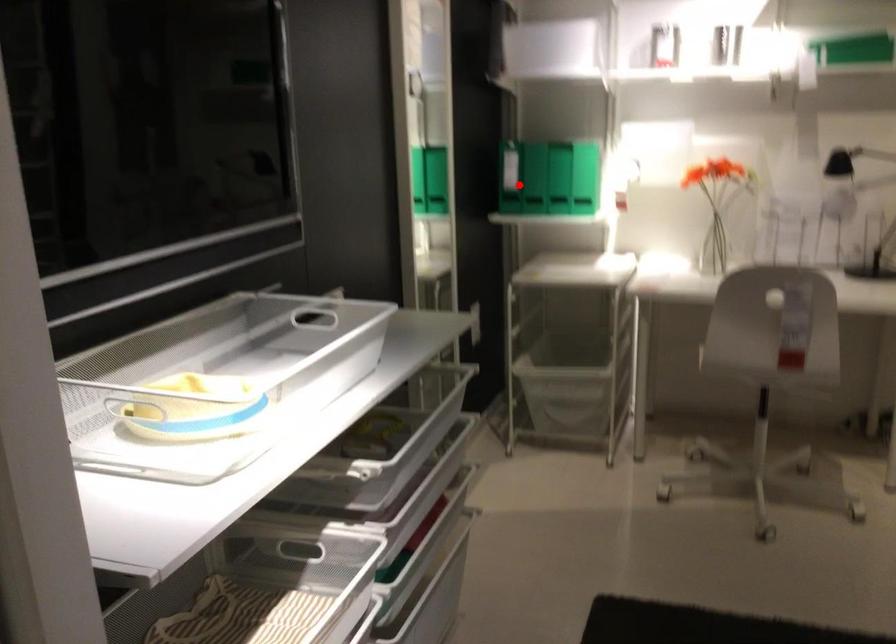
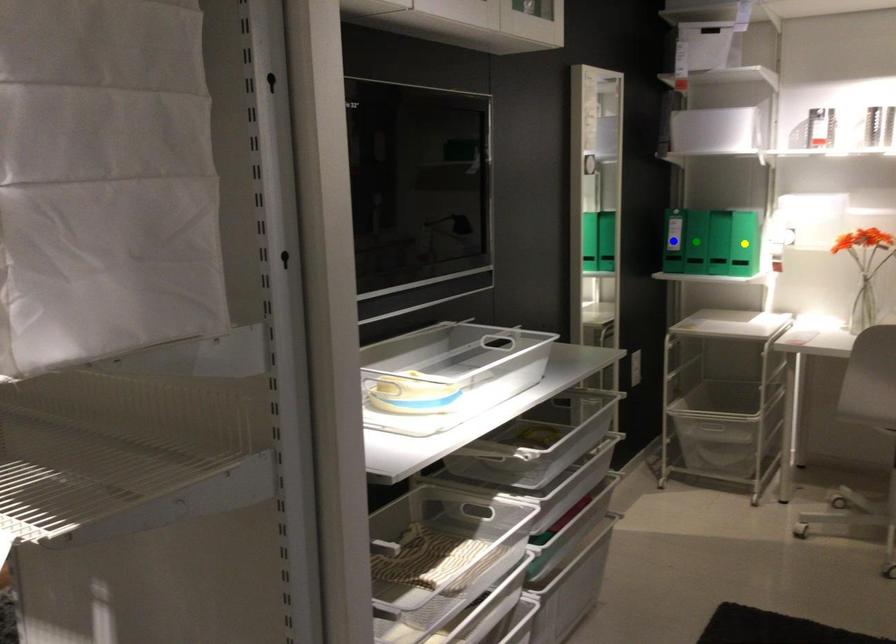
Question: I am providing you with two images of the same scene from different viewpoints. A red point is marked on the first image. You are given multiple points on the second image. Can you choose the point in image 2 that corresponds to the point in image 1?

Choices:
 (A) yellow point
 (B) blue point
 (C) green point

Answer: (C)